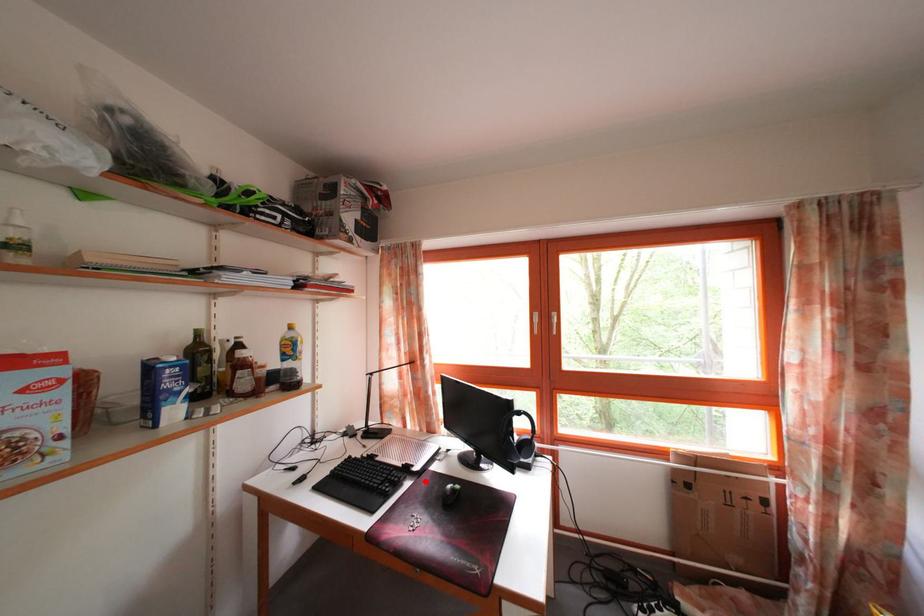
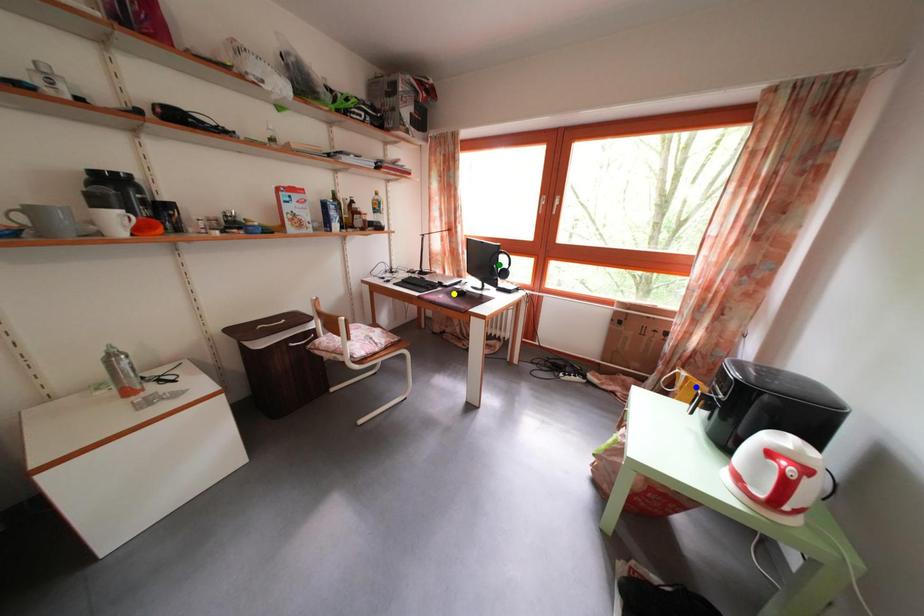
Question: I am providing you with two images of the same scene from different viewpoints. A red point is marked on the first image. You are given multiple points on the second image. Which point in image 2 represents the same 3d spot as the red point in image 1?

Choices:
 (A) green point
 (B) blue point
 (C) yellow point

Answer: (C)